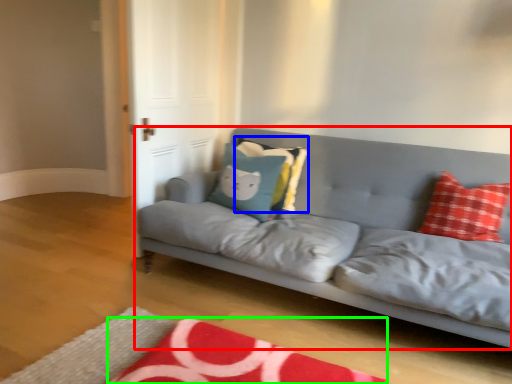
Question: Which object is positioned closest to studio couch (highlighted by a red box)? Select from pillow (highlighted by a blue box) and mat (highlighted by a green box).

Choices:
 (A) pillow
 (B) mat

Answer: (A)